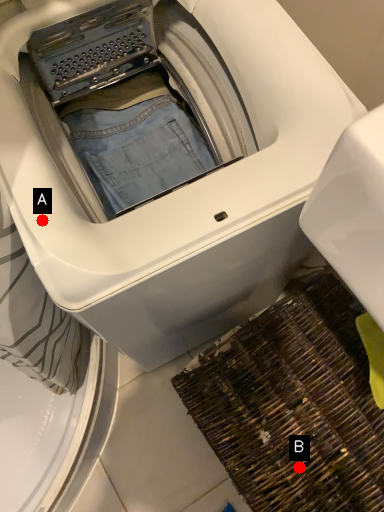
Question: Two points are circled on the image, labeled by A and B beside each circle. Which point appears closest to the camera in this image?

Choices:
 (A) A is closer
 (B) B is closer

Answer: (A)